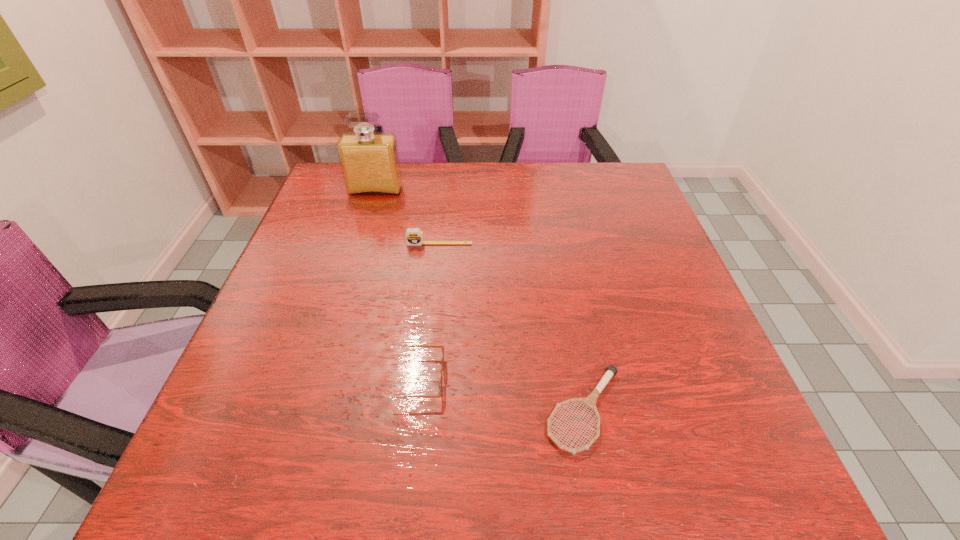
Locate an element on the screen. The width and height of the screenshot is (960, 540). object at the far edge is located at coordinates (370, 165).

The width and height of the screenshot is (960, 540). I want to click on object located at the near edge, so click(590, 401).

Locate an element on the screen. The image size is (960, 540). object located in the left edge section of the desktop is located at coordinates (370, 165).

The height and width of the screenshot is (540, 960). Find the location of `object positioned at the far left corner`. object positioned at the far left corner is located at coordinates (370, 165).

In the image, there is a desktop. Where is `vacant space at the far edge`? Image resolution: width=960 pixels, height=540 pixels. vacant space at the far edge is located at coordinates (401, 197).

Find the location of a particular element. This screenshot has width=960, height=540. vacant space at the near edge of the desktop is located at coordinates (616, 497).

In the image, there is a desktop. Where is `vacant area at the left edge`? The width and height of the screenshot is (960, 540). vacant area at the left edge is located at coordinates (265, 418).

You are a GUI agent. You are given a task and a screenshot of the screen. Output one action in this format:
    pyautogui.click(x=<x>, y=<y>)
    Task: Click on the vacant area at the right edge
    This screenshot has height=540, width=960.
    Given the screenshot: What is the action you would take?
    pyautogui.click(x=623, y=218)

In the image, there is a desktop. At what (x,y) coordinates should I click in order to perform the action: click on free space at the far left corner. Please return your answer as a coordinate pair (x, y). The height and width of the screenshot is (540, 960). Looking at the image, I should click on 327,190.

Where is `vacant space at the far right corner`? vacant space at the far right corner is located at coordinates (612, 195).